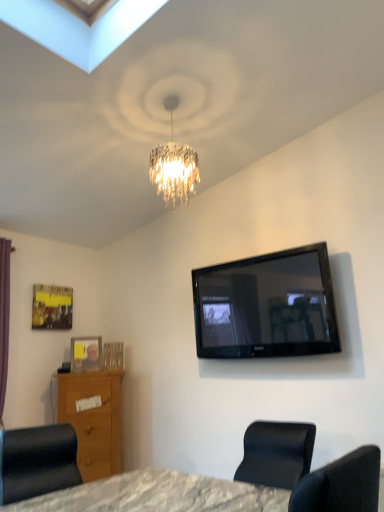
Question: Can you confirm if clear plastic picture frame at lower left, acting as the first picture frame starting from the right, is taller than wooden vanity at lower left?

Choices:
 (A) no
 (B) yes

Answer: (A)

Question: Considering the relative sizes of clear plastic picture frame at lower left, placed as the second picture frame when sorted from top to bottom, and wooden vanity at lower left in the image provided, is clear plastic picture frame at lower left, placed as the second picture frame when sorted from top to bottom, smaller than wooden vanity at lower left?

Choices:
 (A) yes
 (B) no

Answer: (A)

Question: Is clear plastic picture frame at lower left, placed as the second picture frame when sorted from top to bottom, next to wooden vanity at lower left?

Choices:
 (A) yes
 (B) no

Answer: (B)

Question: Does clear plastic picture frame at lower left, which is the second picture frame from left to right, come behind wooden vanity at lower left?

Choices:
 (A) yes
 (B) no

Answer: (A)

Question: Is clear plastic picture frame at lower left, the first picture frame when ordered from bottom to top, looking in the opposite direction of wooden vanity at lower left?

Choices:
 (A) yes
 (B) no

Answer: (B)

Question: Based on their sizes in the image, would you say black glossy tv at upper right is bigger or smaller than wooden vanity at lower left?

Choices:
 (A) big
 (B) small

Answer: (B)

Question: From a real-world perspective, is black glossy tv at upper right above or below wooden vanity at lower left?

Choices:
 (A) below
 (B) above

Answer: (B)

Question: Is black glossy tv at upper right taller or shorter than wooden vanity at lower left?

Choices:
 (A) short
 (B) tall

Answer: (A)

Question: Do you think black glossy tv at upper right is within wooden vanity at lower left, or outside of it?

Choices:
 (A) inside
 (B) outside

Answer: (B)

Question: In the image, is wooden vanity at lower left on the left side or the right side of matte black chair at lower left?

Choices:
 (A) left
 (B) right

Answer: (A)

Question: Is wooden vanity at lower left inside the boundaries of matte black chair at lower left, or outside?

Choices:
 (A) outside
 (B) inside

Answer: (A)

Question: From a real-world perspective, is wooden vanity at lower left above or below matte black chair at lower left?

Choices:
 (A) below
 (B) above

Answer: (B)

Question: Is wooden vanity at lower left bigger or smaller than matte black chair at lower left?

Choices:
 (A) big
 (B) small

Answer: (A)

Question: From the image's perspective, is metallic gold picture frame at upper left, the first picture frame from the left, positioned above or below matte black chair at lower left?

Choices:
 (A) above
 (B) below

Answer: (A)

Question: Based on their sizes in the image, would you say metallic gold picture frame at upper left, which appears as the first picture frame when viewed from the top, is bigger or smaller than matte black chair at lower left?

Choices:
 (A) big
 (B) small

Answer: (B)